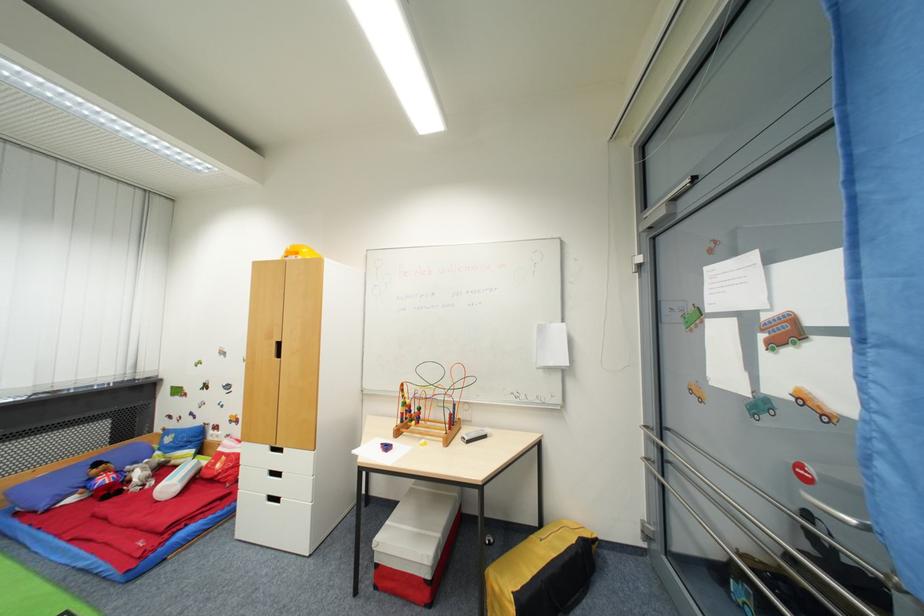
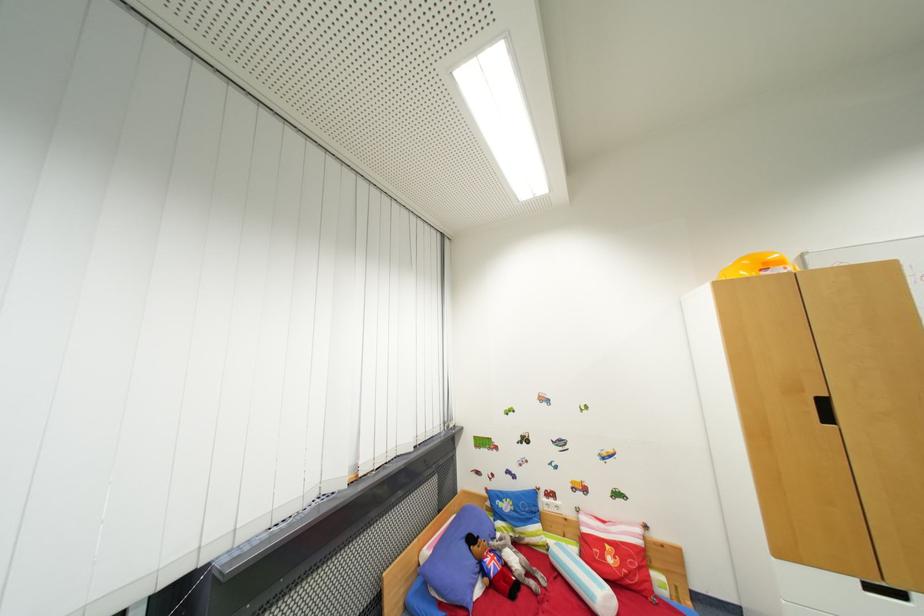
The point at (103, 467) is marked in the first image. Where is the corresponding point in the second image?

(477, 541)